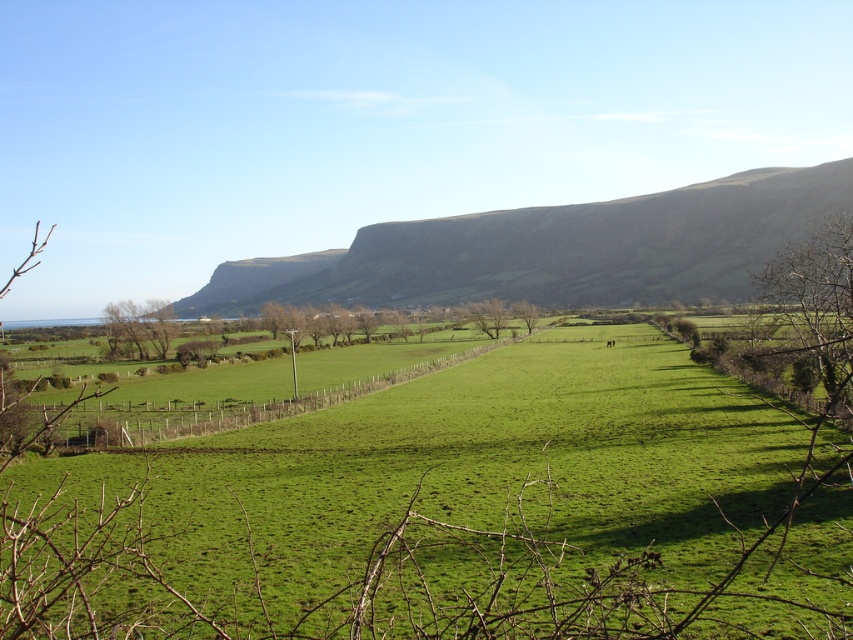
Question: Is green grassy field at center bigger than green leafy tree at lower left?

Choices:
 (A) no
 (B) yes

Answer: (B)

Question: Which of the following is the closest to the observer?

Choices:
 (A) (86, 496)
 (B) (102, 316)
 (C) (529, 305)
 (D) (294, 291)

Answer: (A)

Question: Is green grassy field at center thinner than dark brown rocky cliff at center?

Choices:
 (A) no
 (B) yes

Answer: (B)

Question: Is dark brown rocky cliff at center further to camera compared to green leafy tree at lower left?

Choices:
 (A) yes
 (B) no

Answer: (A)

Question: Which point is closer to the camera?

Choices:
 (A) green leafy tree at lower left
 (B) dark brown rocky cliff at center
 (C) green leafy tree at center

Answer: (A)

Question: Which object is farther from the camera taking this photo?

Choices:
 (A) green leafy tree at center
 (B) green leafy tree at lower left

Answer: (A)